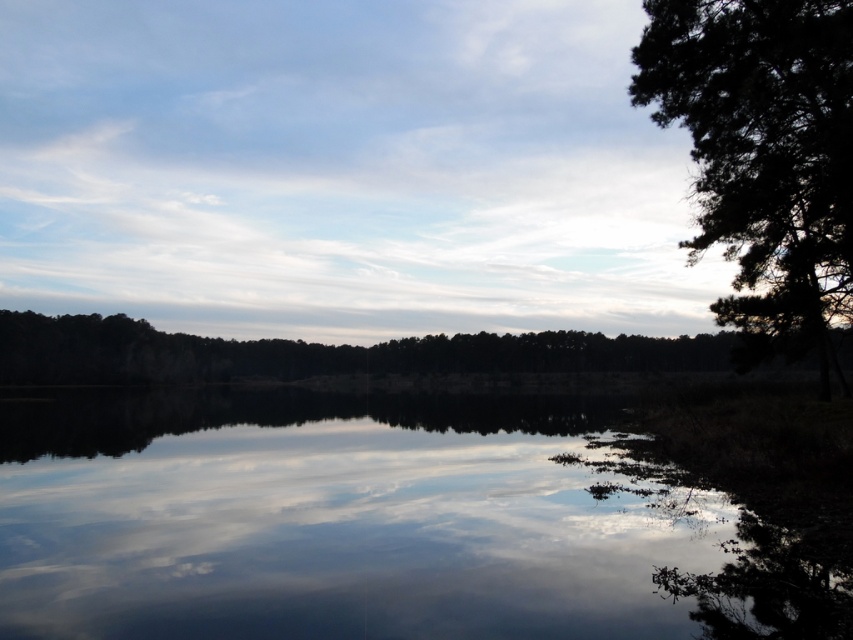
You are a photographer planning to capture the reflection of the smooth reflective water at center. To ensure the reflection is perfectly centered in your photo, where should you position your camera relative to the water?

The smooth reflective water at center is located at point 0.819 on the x axis and 0.441 on the y axis. To center the reflection, position your camera directly above or aligned with these coordinates so the water is at the center of your frame.

You are standing at the center of the scene and see two points, point (x=96, y=621) and point (x=769, y=115). Which point is closer to your current position?

Point (x=96, y=621) is closer to your current position because it is in front of point (x=769, y=115).

You are an artist trying to paint this scene. You want to ensure the smooth reflective water at center and the dark green textured tree at right are proportionally accurate. Which object should you paint larger?

The smooth reflective water at center should be painted larger than the dark green textured tree at right because it is bigger in the scene.